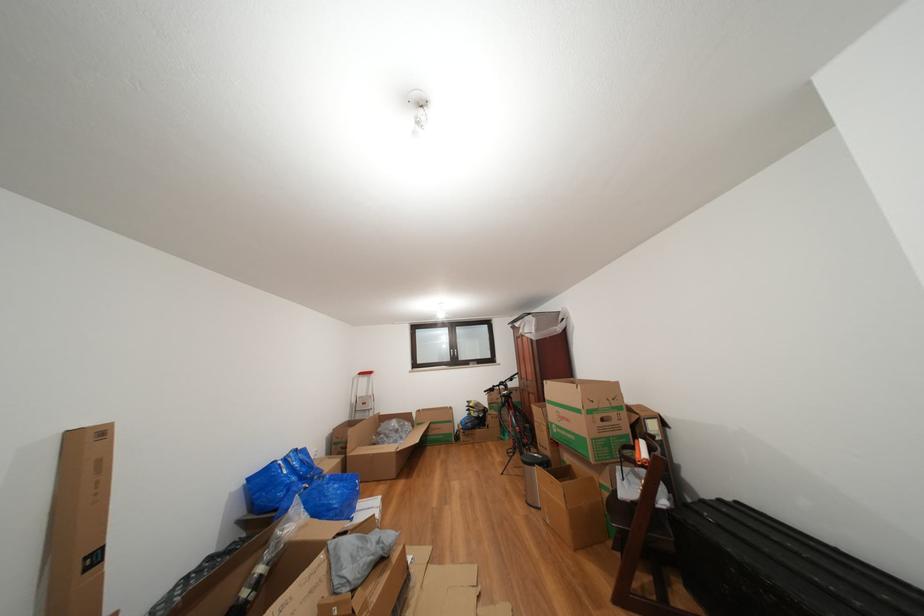
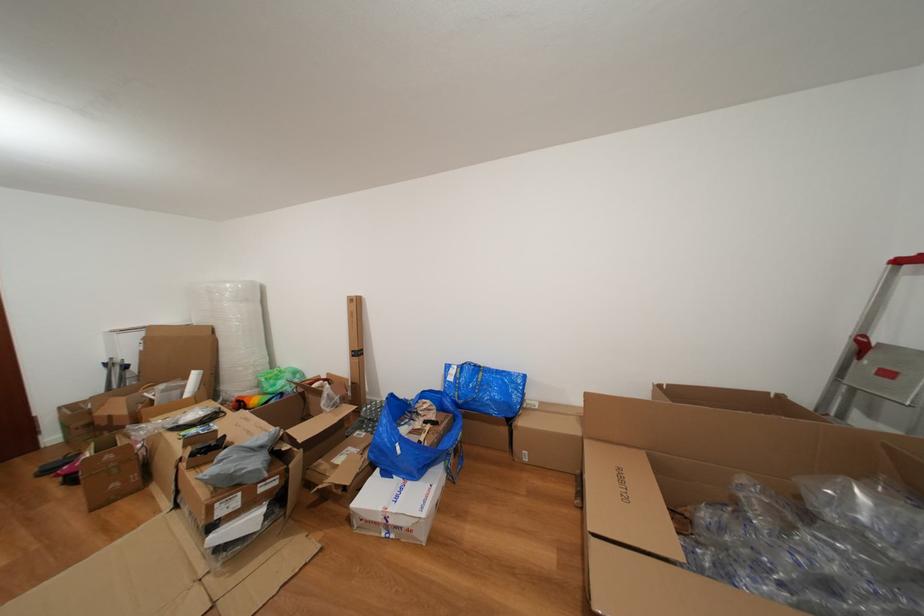
Find the pixel in the second image that matches [294,477] in the first image.

(458, 384)